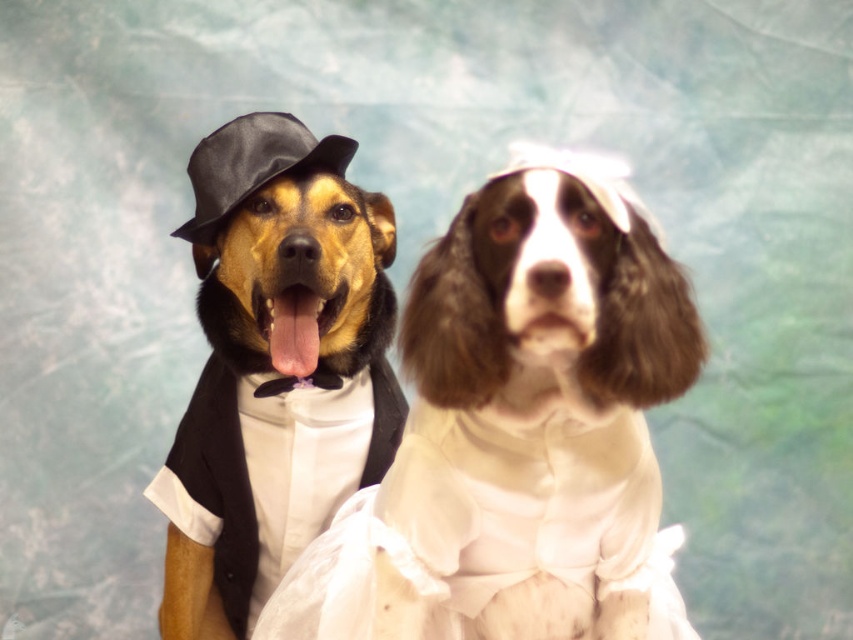
Question: Which object is positioned closest to the white satin dress at center?

Choices:
 (A) black satin hat at upper left
 (B) shiny black tuxedo at left
 (C) shiny black hat at left

Answer: (B)

Question: Is shiny black tuxedo at left smaller than black satin hat at upper left?

Choices:
 (A) no
 (B) yes

Answer: (A)

Question: Based on their relative distances, which object is farther from the shiny black tuxedo at left?

Choices:
 (A) black satin hat at upper left
 (B) shiny black hat at left
 (C) white satin dress at center

Answer: (A)

Question: Observing the image, what is the correct spatial positioning of shiny black tuxedo at left in reference to black satin hat at upper left?

Choices:
 (A) left
 (B) right

Answer: (B)

Question: Can you confirm if shiny black hat at left is wider than black satin hat at upper left?

Choices:
 (A) yes
 (B) no

Answer: (A)

Question: Which of these objects is positioned farthest from the shiny black tuxedo at left?

Choices:
 (A) shiny black hat at left
 (B) white satin dress at center
 (C) black satin hat at upper left

Answer: (C)